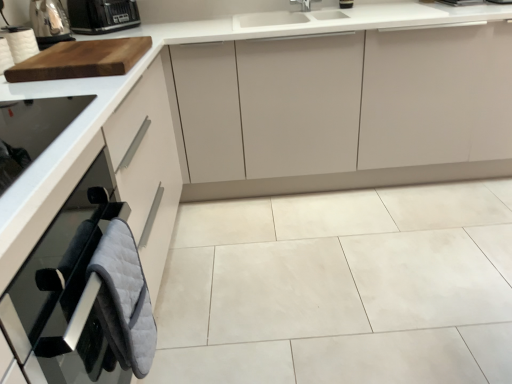
Question: Is white ceramic tile at center directly adjacent to white paper towel at upper left?

Choices:
 (A) no
 (B) yes

Answer: (A)

Question: Would you say white ceramic tile at center is a long distance from white paper towel at upper left?

Choices:
 (A) no
 (B) yes

Answer: (B)

Question: Is white ceramic tile at center shorter than white paper towel at upper left?

Choices:
 (A) yes
 (B) no

Answer: (A)

Question: Is white paper towel at upper left at the back of white ceramic tile at center?

Choices:
 (A) yes
 (B) no

Answer: (B)

Question: Considering the relative sizes of white ceramic tile at center and white paper towel at upper left in the image provided, is white ceramic tile at center wider than white paper towel at upper left?

Choices:
 (A) yes
 (B) no

Answer: (A)

Question: Does point [x=58, y=4] appear closer or farther from the camera than point [x=139, y=316]?

Choices:
 (A) farther
 (B) closer

Answer: (A)

Question: Is metallic silver toaster at upper left taller or shorter than gray quilted oven mitts at lower left?

Choices:
 (A) tall
 (B) short

Answer: (B)

Question: In the image, is metallic silver toaster at upper left on the left side or the right side of gray quilted oven mitts at lower left?

Choices:
 (A) left
 (B) right

Answer: (A)

Question: Is metallic silver toaster at upper left inside or outside of gray quilted oven mitts at lower left?

Choices:
 (A) inside
 (B) outside

Answer: (B)

Question: Considering the positions of white ceramic tile at center and gray quilted oven mitts at lower left in the image, is white ceramic tile at center wider or thinner than gray quilted oven mitts at lower left?

Choices:
 (A) thin
 (B) wide

Answer: (B)

Question: Relative to gray quilted oven mitts at lower left, is white ceramic tile at center in front or behind?

Choices:
 (A) front
 (B) behind

Answer: (B)

Question: Looking at the image, does white ceramic tile at center seem bigger or smaller compared to gray quilted oven mitts at lower left?

Choices:
 (A) big
 (B) small

Answer: (A)

Question: Is white ceramic tile at center taller or shorter than gray quilted oven mitts at lower left?

Choices:
 (A) tall
 (B) short

Answer: (B)

Question: Is matte white cabinet at center, positioned as the first cabinetry in top-to-bottom order, situated inside white paper towel at upper left or outside?

Choices:
 (A) inside
 (B) outside

Answer: (B)

Question: From the image's perspective, is matte white cabinet at center, the 1th cabinetry viewed from the back, located above or below white paper towel at upper left?

Choices:
 (A) above
 (B) below

Answer: (A)